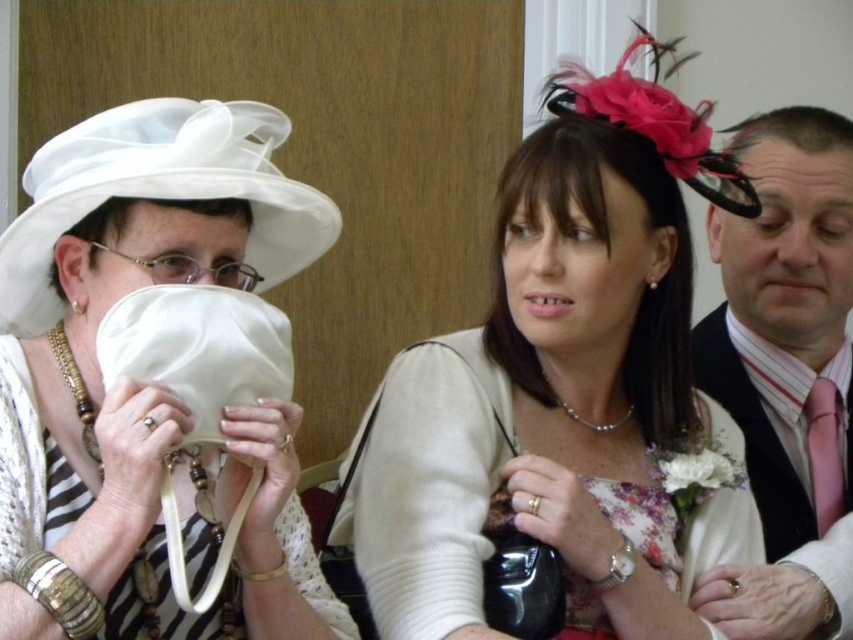
Which object is closer to the viewer between the satin floral dress at center and the pink satin tie at right?

The satin floral dress at center is closer to the viewer than the pink satin tie at right.